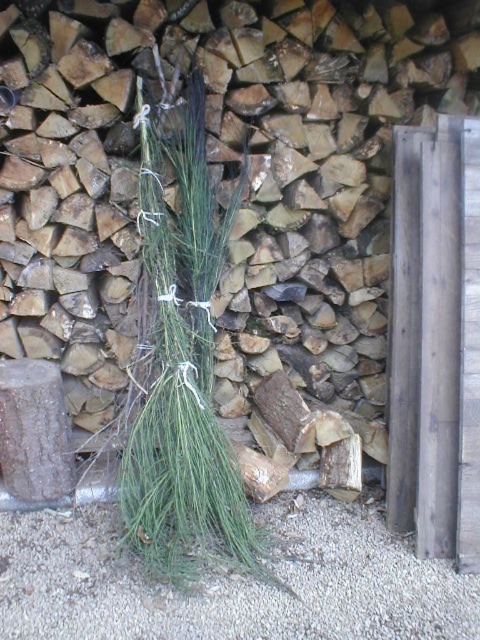
Does green grass bundle at center have a lesser width compared to gray gravel at lower center?

In fact, green grass bundle at center might be wider than gray gravel at lower center.

Based on the photo, which of these two, green grass bundle at center or gray gravel at lower center, stands taller?

green grass bundle at center

Is point (111, 58) closer to camera compared to point (266, 515)?

Yes, it is in front of point (266, 515).

I want to click on green grass bundle at center, so click(x=320, y=154).

How far apart are gray gravel at lower center and green grass at center?

gray gravel at lower center is 22.56 inches from green grass at center.

How much distance is there between gray gravel at lower center and green grass at center?

22.56 inches

Is point (192, 596) positioned before point (182, 563)?

Yes, point (192, 596) is closer to viewer.

Locate an element on the screen. The image size is (480, 640). gray gravel at lower center is located at coordinates (231, 584).

Is green grass bundle at center above green grass at center?

Yes, green grass bundle at center is above green grass at center.

Does green grass bundle at center lie in front of green grass at center?

No, it is not.

Between point (279, 246) and point (186, 172), which one is positioned behind?

Positioned behind is point (279, 246).

Find the location of a particular element. This screenshot has height=640, width=480. green grass bundle at center is located at coordinates (320, 154).